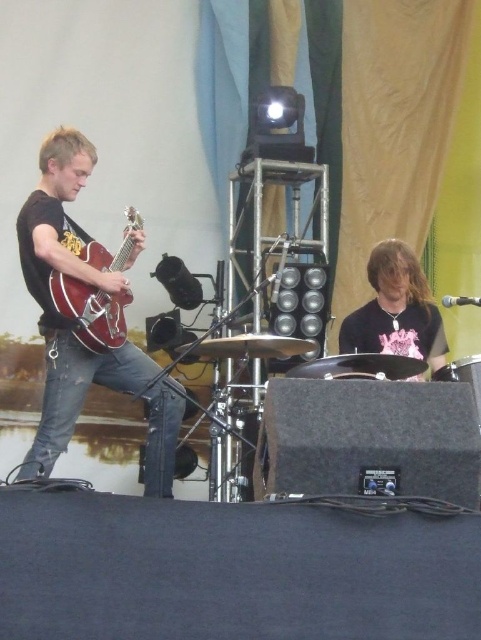
Question: Can you confirm if shiny black shirt at center is positioned to the left of glossy wood guitar at left?

Choices:
 (A) no
 (B) yes

Answer: (A)

Question: Which point appears closest to the camera in this image?

Choices:
 (A) (98, 333)
 (B) (53, 380)

Answer: (A)

Question: Which point is farther from the camera taking this photo?

Choices:
 (A) click(x=63, y=305)
 (B) click(x=403, y=243)

Answer: (B)

Question: Among these points, which one is farthest from the camera?

Choices:
 (A) (106, 326)
 (B) (437, 332)
 (C) (43, 218)

Answer: (B)

Question: Does glossy wood guitar at left have a greater width compared to black drum at center?

Choices:
 (A) no
 (B) yes

Answer: (A)

Question: From the image, what is the correct spatial relationship of matte black guitar at left in relation to black drum at center?

Choices:
 (A) right
 (B) left

Answer: (B)